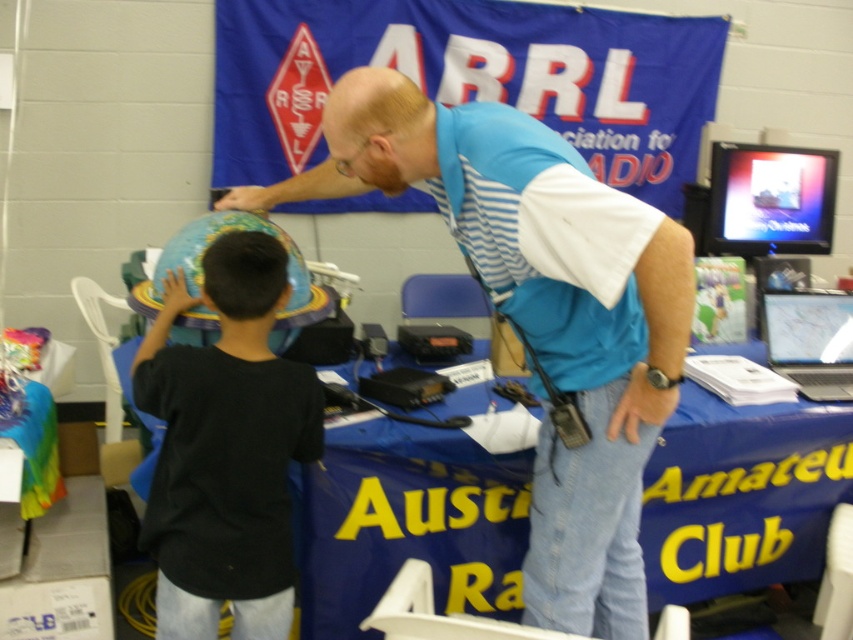
Question: Is black matte globe at left below black matte hair at upper left?

Choices:
 (A) yes
 (B) no

Answer: (A)

Question: Observing the image, what is the correct spatial positioning of black matte globe at left in reference to bald scalp at upper center?

Choices:
 (A) left
 (B) right

Answer: (A)

Question: Is blue striped shirt at upper center closer to the viewer compared to bald scalp at upper center?

Choices:
 (A) no
 (B) yes

Answer: (B)

Question: Estimate the real-world distances between objects in this image. Which object is farther from the blue striped shirt at upper center?

Choices:
 (A) black matte hair at upper left
 (B) black matte globe at left

Answer: (B)

Question: Which object appears farthest from the camera in this image?

Choices:
 (A) black matte globe at left
 (B) blue striped shirt at upper center
 (C) bald scalp at upper center
 (D) black matte hair at upper left

Answer: (D)

Question: Which is farther from the bald scalp at upper center?

Choices:
 (A) blue striped shirt at upper center
 (B) black matte hair at upper left
 (C) black matte globe at left

Answer: (C)